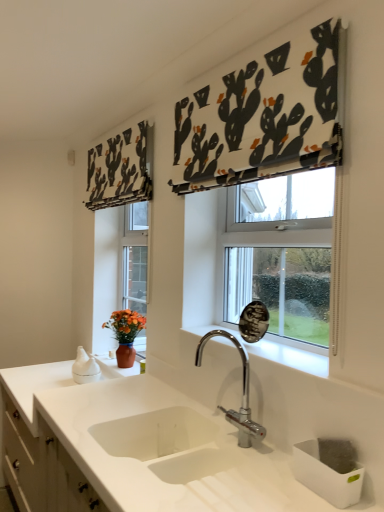
Question: From the image's perspective, is white fabric with cactus print at upper center, acting as the second curtain starting from the back, on black fabric cactus-patterned curtain at upper left, which is the second curtain from right to left?

Choices:
 (A) yes
 (B) no

Answer: (B)

Question: From a real-world perspective, is white fabric with cactus print at upper center, placed as the 2th curtain when sorted from left to right, located higher than black fabric cactus-patterned curtain at upper left, the first curtain when ordered from left to right?

Choices:
 (A) yes
 (B) no

Answer: (A)

Question: Considering the relative sizes of white fabric with cactus print at upper center, the 1th curtain from the right, and black fabric cactus-patterned curtain at upper left, which is the second curtain from right to left, in the image provided, is white fabric with cactus print at upper center, the 1th curtain from the right, wider than black fabric cactus-patterned curtain at upper left, which is the second curtain from right to left,?

Choices:
 (A) yes
 (B) no

Answer: (B)

Question: Can you see white fabric with cactus print at upper center, acting as the second curtain starting from the back, touching black fabric cactus-patterned curtain at upper left, the first curtain when ordered from left to right?

Choices:
 (A) yes
 (B) no

Answer: (B)

Question: Is black fabric cactus-patterned curtain at upper left, which is the second curtain from right to left, at the back of white fabric with cactus print at upper center, acting as the second curtain starting from the back?

Choices:
 (A) no
 (B) yes

Answer: (A)

Question: Is white fabric with cactus print at upper center, placed as the 2th curtain when sorted from left to right, to the left or to the right of chrome metallic faucet at center in the image?

Choices:
 (A) right
 (B) left

Answer: (A)

Question: From a real-world perspective, relative to chrome metallic faucet at center, is white fabric with cactus print at upper center, acting as the second curtain starting from the back, vertically above or below?

Choices:
 (A) below
 (B) above

Answer: (B)

Question: Do you think white fabric with cactus print at upper center, placed as the 2th curtain when sorted from left to right, is within chrome metallic faucet at center, or outside of it?

Choices:
 (A) inside
 (B) outside

Answer: (B)

Question: Is white fabric with cactus print at upper center, marked as the 1th curtain in a front-to-back arrangement, wider or thinner than chrome metallic faucet at center?

Choices:
 (A) thin
 (B) wide

Answer: (A)

Question: From the image's perspective, relative to white glossy sink at center, is white fabric with cactus print at upper center, marked as the 1th curtain in a front-to-back arrangement, above or below?

Choices:
 (A) below
 (B) above

Answer: (B)

Question: Would you say white fabric with cactus print at upper center, acting as the second curtain starting from the back, is inside or outside white glossy sink at center?

Choices:
 (A) outside
 (B) inside

Answer: (A)

Question: In terms of height, does white fabric with cactus print at upper center, the 1th curtain from the right, look taller or shorter compared to white glossy sink at center?

Choices:
 (A) tall
 (B) short

Answer: (A)

Question: Considering their positions, is white fabric with cactus print at upper center, the 1th curtain from the right, located in front of or behind white glossy sink at center?

Choices:
 (A) front
 (B) behind

Answer: (A)

Question: In the image, is orange matte vase at left on the left side or the right side of white glossy cabinet at lower left?

Choices:
 (A) right
 (B) left

Answer: (A)

Question: Considering the positions of orange matte vase at left and white glossy cabinet at lower left in the image, is orange matte vase at left wider or thinner than white glossy cabinet at lower left?

Choices:
 (A) thin
 (B) wide

Answer: (A)